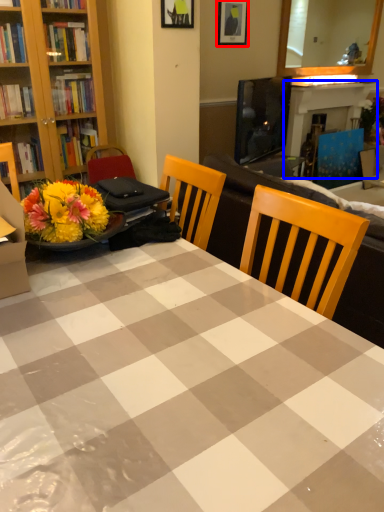
Question: Among these objects, which one is nearest to the camera, picture frame (highlighted by a red box) or fireplace (highlighted by a blue box)?

Choices:
 (A) picture frame
 (B) fireplace

Answer: (A)